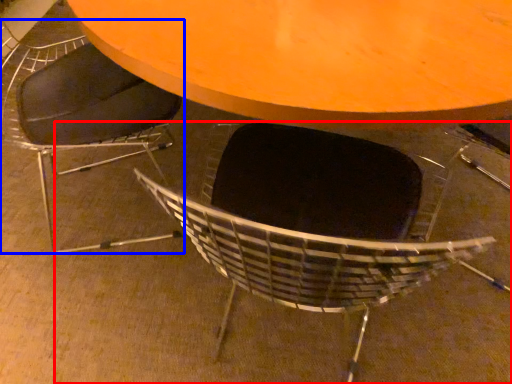
Question: Which object appears closest to the camera in this image, chair (highlighted by a red box) or chair (highlighted by a blue box)?

Choices:
 (A) chair
 (B) chair

Answer: (A)